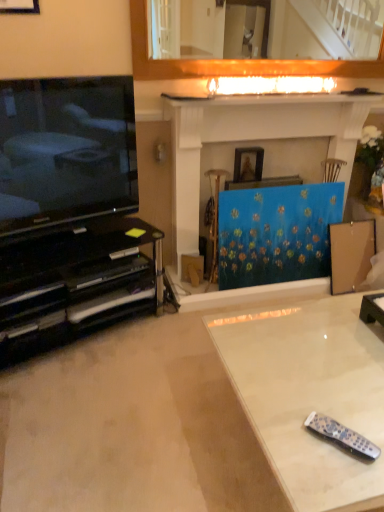
Where is `vacant area on top of white glossy mantle at upper center (from a real-world perspective)`? vacant area on top of white glossy mantle at upper center (from a real-world perspective) is located at coordinates (267, 94).